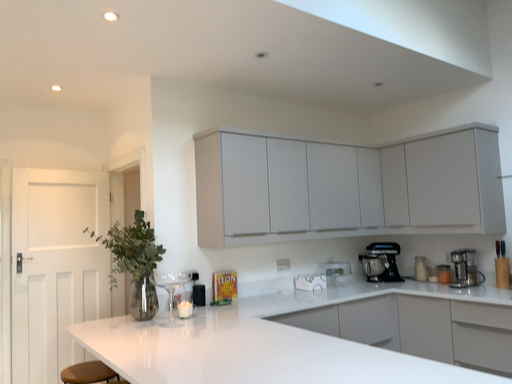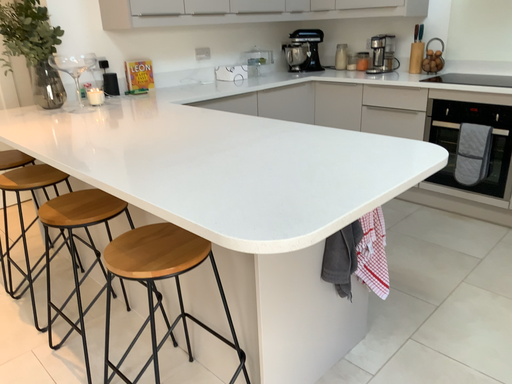
Question: Which way did the camera rotate in the video?

Choices:
 (A) rotated right
 (B) rotated left

Answer: (A)